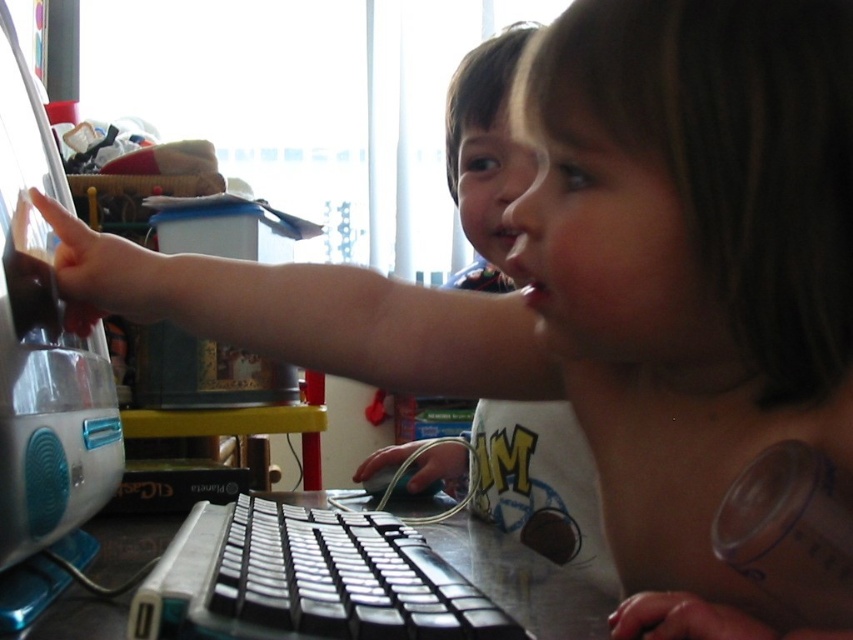
Which is more to the left, black plastic keyboard at center or pink matte lips at center?

From the viewer's perspective, black plastic keyboard at center appears more on the left side.

Can you confirm if black plastic keyboard at center is taller than pink matte lips at center?

In fact, black plastic keyboard at center may be shorter than pink matte lips at center.

Does point (408, 604) lie behind point (544, 300)?

No, (408, 604) is in front of (544, 300).

You are a GUI agent. You are given a task and a screenshot of the screen. Output one action in this format:
    pyautogui.click(x=<x>, y=<y>)
    Task: Click on the black plastic keyboard at center
    The width and height of the screenshot is (853, 640).
    Given the screenshot: What is the action you would take?
    pyautogui.click(x=308, y=579)

Does teal plastic desktop computer at left have a lesser height compared to black plastic keyboard at center?

In fact, teal plastic desktop computer at left may be taller than black plastic keyboard at center.

Find the location of a particular element. teal plastic desktop computer at left is located at coordinates (42, 371).

Is point (15, 278) farther from viewer compared to point (531, 276)?

Yes, point (15, 278) is behind point (531, 276).

The height and width of the screenshot is (640, 853). What do you see at coordinates (42, 371) in the screenshot? I see `teal plastic desktop computer at left` at bounding box center [42, 371].

Locate an element on the screen. The height and width of the screenshot is (640, 853). teal plastic desktop computer at left is located at coordinates (42, 371).